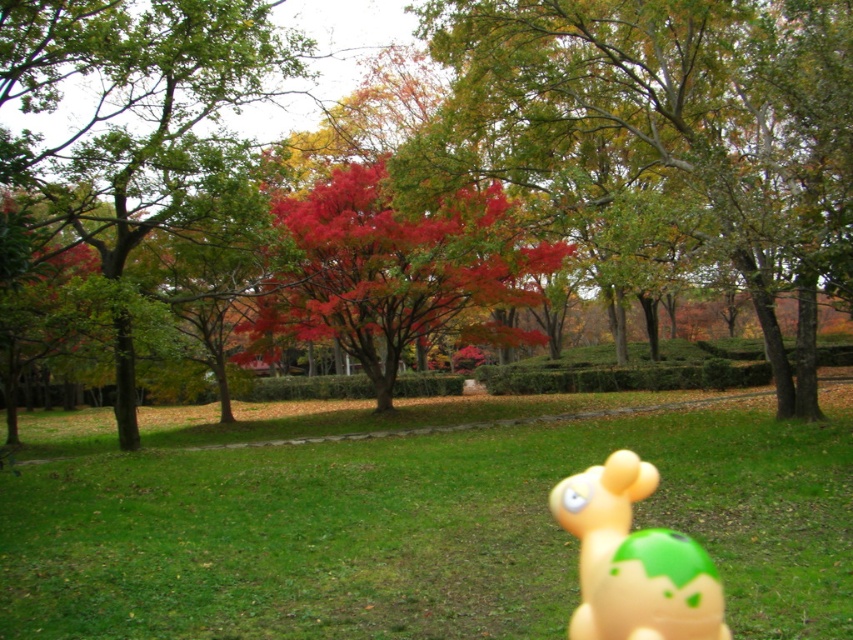
You are standing in the autumnal park scene. You want to place a small decorative rock exactly at the center of the green grass at center. According to the coordinates provided, where should you place the rock?

The green grass at center is located at coordinates point (421, 531), so you should place the rock there.